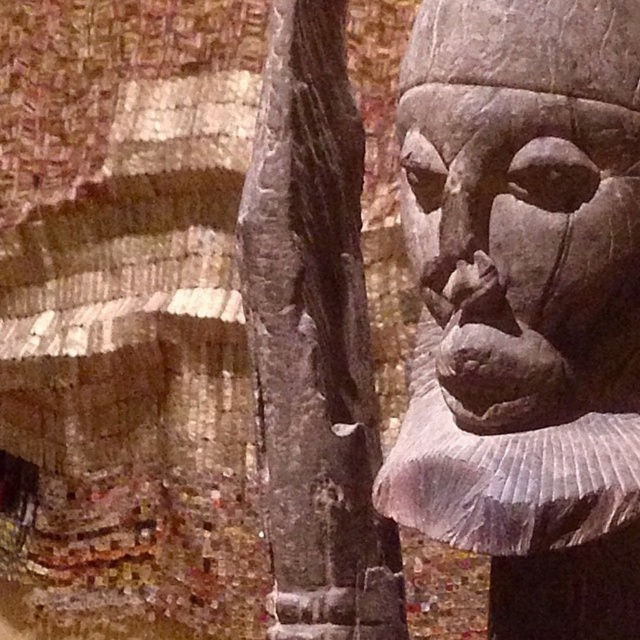
Question: Does gray stone head at upper right appear under dark gray stone pillar at center?

Choices:
 (A) yes
 (B) no

Answer: (B)

Question: Among these points, which one is farthest from the camera?

Choices:
 (A) (314, 524)
 (B) (627, 221)

Answer: (A)

Question: Which point is farther to the camera?

Choices:
 (A) gray stone head at upper right
 (B) dark gray stone pillar at center

Answer: (B)

Question: Is gray stone head at upper right closer to camera compared to dark gray stone pillar at center?

Choices:
 (A) no
 (B) yes

Answer: (B)

Question: Does gray stone head at upper right appear under dark gray stone pillar at center?

Choices:
 (A) yes
 (B) no

Answer: (B)